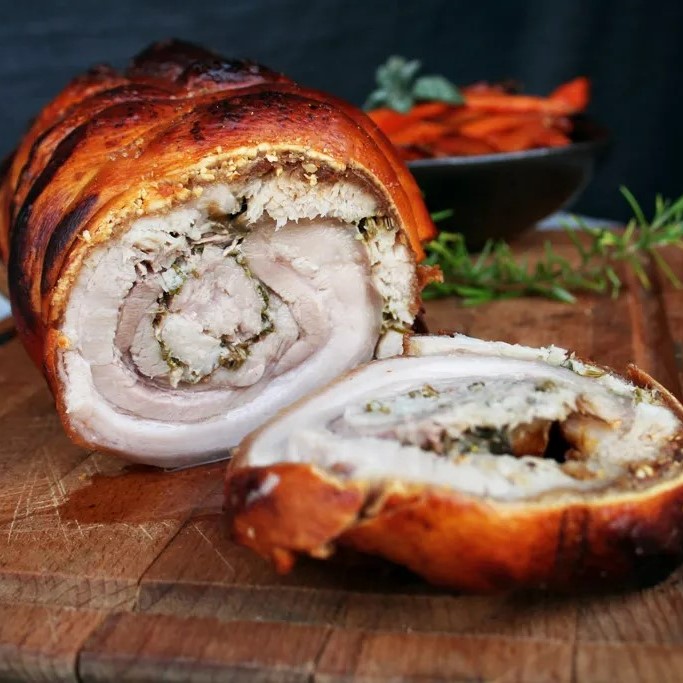
Where is `edge of cutting board`? The image size is (683, 683). edge of cutting board is located at coordinates [64, 669].